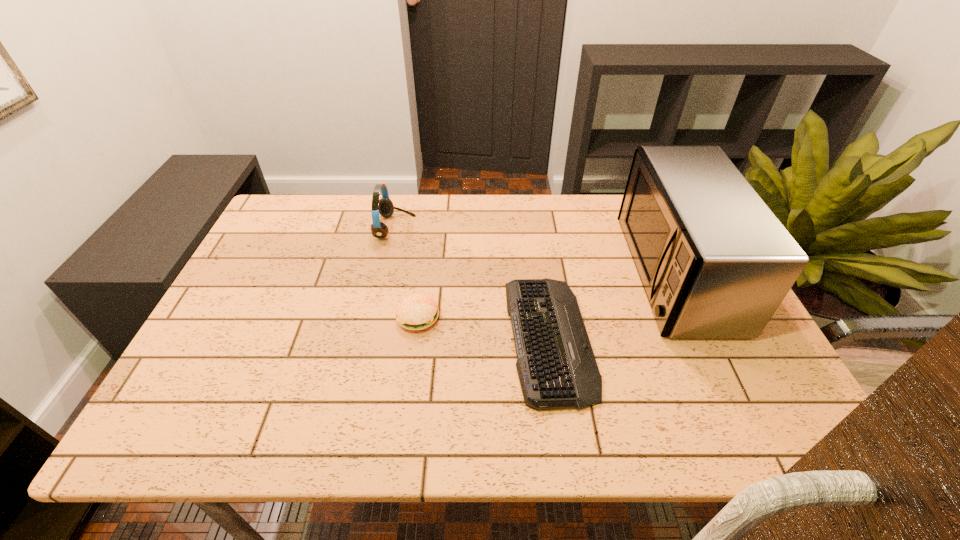
Identify the location of vacant space located 0.090m on the left of the third tallest object. (361, 318).

The width and height of the screenshot is (960, 540). Identify the location of vacant space located 0.290m on the back of the shortest object. (533, 218).

You are a GUI agent. You are given a task and a screenshot of the screen. Output one action in this format:
    pyautogui.click(x=<x>, y=<y>)
    Task: Click on the microwave_oven that is positioned at the far edge
    
    Given the screenshot: What is the action you would take?
    pyautogui.click(x=715, y=262)

Locate an element on the screen. Image resolution: width=960 pixels, height=540 pixels. headset present at the far edge is located at coordinates (384, 206).

Locate an element on the screen. object that is at the near edge is located at coordinates (556, 366).

Locate an element on the screen. object located in the right edge section of the desktop is located at coordinates (715, 262).

At what (x,y) coordinates should I click in order to perform the action: click on object that is positioned at the far right corner. Please return your answer as a coordinate pair (x, y). This screenshot has width=960, height=540. Looking at the image, I should click on (715, 262).

In the image, there is a desktop. At what (x,y) coordinates should I click in order to perform the action: click on vacant space at the far edge. Please return your answer as a coordinate pair (x, y). This screenshot has width=960, height=540. Looking at the image, I should click on (468, 199).

In the image, there is a desktop. Identify the location of vacant area at the near edge. (684, 416).

Identify the location of free space at the left edge of the desktop. [313, 241].